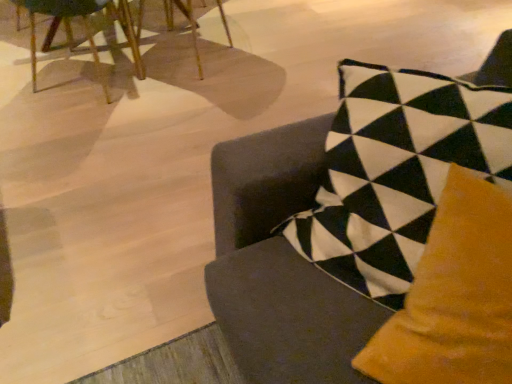
Describe the element at coordinates (280, 265) in the screenshot. The width and height of the screenshot is (512, 384). I see `velvet cushion at center, the third chair positioned from the left` at that location.

Find the location of a particular element. The height and width of the screenshot is (384, 512). velvet cushion at center, the 3th chair when ordered from back to front is located at coordinates (280, 265).

The image size is (512, 384). What do you see at coordinates (85, 30) in the screenshot?
I see `wooden chair at upper left, acting as the second chair starting from the back` at bounding box center [85, 30].

Find the location of a particular element. The image size is (512, 384). wooden chair at upper left, positioned as the third chair in front-to-back order is located at coordinates (188, 25).

You are a GUI agent. You are given a task and a screenshot of the screen. Output one action in this format:
    pyautogui.click(x=<x>, y=<y>)
    Task: Click on the velvet cushion at center, marked as the first chair in a right-to-left arrangement
    Image resolution: width=512 pixels, height=384 pixels.
    Given the screenshot: What is the action you would take?
    pyautogui.click(x=280, y=265)

From a real-world perspective, is velvet cushion at center, the 3th chair when ordered from back to front, physically above wooden chair at upper left, which is counted as the first chair, starting from the left?

Yes, from a real-world perspective, velvet cushion at center, the 3th chair when ordered from back to front, is over wooden chair at upper left, which is counted as the first chair, starting from the left

Is wooden chair at upper left, acting as the second chair starting from the back, inside velvet cushion at center, the third chair positioned from the left?

No.

What's the angular difference between velvet cushion at center, which ranks as the 1th chair in front-to-back order, and wooden chair at upper left, placed as the second chair when sorted from front to back,'s facing directions?

velvet cushion at center, which ranks as the 1th chair in front-to-back order, and wooden chair at upper left, placed as the second chair when sorted from front to back, are facing 136 degrees away from each other.

Which is behind, point (170, 9) or point (99, 75)?

The point (170, 9) is farther.

Is wooden chair at upper left, the 2th chair viewed from the right, looking in the opposite direction of wooden chair at upper left, acting as the second chair starting from the back?

That's not correct — wooden chair at upper left, the 2th chair viewed from the right, is not looking away from wooden chair at upper left, acting as the second chair starting from the back.

From a real-world perspective, between wooden chair at upper left, which is the 1th chair from back to front, and wooden chair at upper left, placed as the second chair when sorted from front to back, who is vertically lower?

wooden chair at upper left, which is the 1th chair from back to front.

From the image's perspective, is wooden chair at upper left, positioned as the third chair in front-to-back order, located above or below wooden chair at upper left, placed as the second chair when sorted from front to back?

wooden chair at upper left, positioned as the third chair in front-to-back order, is situated higher than wooden chair at upper left, placed as the second chair when sorted from front to back, in the image.

Would you say wooden chair at upper left, acting as the second chair starting from the back, is inside or outside wooden chair at upper left, the 2th chair in the left-to-right sequence?

wooden chair at upper left, acting as the second chair starting from the back, is located beyond the bounds of wooden chair at upper left, the 2th chair in the left-to-right sequence.

Are wooden chair at upper left, which is the third chair in right-to-left order, and wooden chair at upper left, the 2th chair in the left-to-right sequence, making contact?

No, wooden chair at upper left, which is the third chair in right-to-left order, is not next to wooden chair at upper left, the 2th chair in the left-to-right sequence.

From the image's perspective, between wooden chair at upper left, which is the third chair in right-to-left order, and wooden chair at upper left, the 2th chair viewed from the right, which one is located above?

wooden chair at upper left, the 2th chair viewed from the right, is shown above in the image.

Between wooden chair at upper left, placed as the second chair when sorted from front to back, and wooden chair at upper left, the 2th chair viewed from the right, which one appears on the left side from the viewer's perspective?

From the viewer's perspective, wooden chair at upper left, placed as the second chair when sorted from front to back, appears more on the left side.

Which is correct: wooden chair at upper left, positioned as the third chair in front-to-back order, is inside velvet cushion at center, the 3th chair when ordered from back to front, or outside of it?

wooden chair at upper left, positioned as the third chair in front-to-back order, exists outside the volume of velvet cushion at center, the 3th chair when ordered from back to front.

Considering the relative positions of wooden chair at upper left, the 2th chair viewed from the right, and velvet cushion at center, marked as the first chair in a right-to-left arrangement, in the image provided, is wooden chair at upper left, the 2th chair viewed from the right, behind velvet cushion at center, marked as the first chair in a right-to-left arrangement,?

That is True.

Does wooden chair at upper left, which is the 1th chair from back to front, turn towards velvet cushion at center, marked as the first chair in a right-to-left arrangement?

No, wooden chair at upper left, which is the 1th chair from back to front, does not turn towards velvet cushion at center, marked as the first chair in a right-to-left arrangement.

Does point (242, 333) come behind point (201, 66)?

That is False.

Can you confirm if velvet cushion at center, which ranks as the 1th chair in front-to-back order, is wider than wooden chair at upper left, positioned as the third chair in front-to-back order?

Incorrect, the width of velvet cushion at center, which ranks as the 1th chair in front-to-back order, does not surpass that of wooden chair at upper left, positioned as the third chair in front-to-back order.

Is velvet cushion at center, the 3th chair when ordered from back to front, closer to the viewer compared to wooden chair at upper left, positioned as the third chair in front-to-back order?

Yes, velvet cushion at center, the 3th chair when ordered from back to front, is closer to the viewer.

Could wooden chair at upper left, the 2th chair viewed from the right, be considered to be inside velvet cushion at center, which ranks as the 1th chair in front-to-back order?

No, wooden chair at upper left, the 2th chair viewed from the right, is not surrounded by velvet cushion at center, which ranks as the 1th chair in front-to-back order.

Considering the sizes of objects wooden chair at upper left, which is the third chair in right-to-left order, and velvet cushion at center, the third chair positioned from the left, in the image provided, who is wider, wooden chair at upper left, which is the third chair in right-to-left order, or velvet cushion at center, the third chair positioned from the left,?

With larger width is wooden chair at upper left, which is the third chair in right-to-left order.

From a real-world perspective, who is located lower, wooden chair at upper left, acting as the second chair starting from the back, or velvet cushion at center, which ranks as the 1th chair in front-to-back order?

wooden chair at upper left, acting as the second chair starting from the back, is physically lower.

Is wooden chair at upper left, placed as the second chair when sorted from front to back, positioned in front of velvet cushion at center, the 3th chair when ordered from back to front?

No, it is behind velvet cushion at center, the 3th chair when ordered from back to front.

Which of these two, wooden chair at upper left, which is the third chair in right-to-left order, or velvet cushion at center, marked as the first chair in a right-to-left arrangement, is smaller?

Smaller between the two is wooden chair at upper left, which is the third chair in right-to-left order.

From the image's perspective, count 1st chairs upward from the velvet cushion at center, the third chair positioned from the left, and point to it. Please provide its 2D coordinates.

[(85, 30)]

The width and height of the screenshot is (512, 384). Identify the location of chair located behind the wooden chair at upper left, acting as the second chair starting from the back. (188, 25).

Looking at the image, which one is located further to velvet cushion at center, marked as the first chair in a right-to-left arrangement, wooden chair at upper left, which is the third chair in right-to-left order, or wooden chair at upper left, the 2th chair viewed from the right?

wooden chair at upper left, the 2th chair viewed from the right, is positioned further to the anchor velvet cushion at center, marked as the first chair in a right-to-left arrangement.

Looking at the image, which one is located further to wooden chair at upper left, which is counted as the first chair, starting from the left, velvet cushion at center, the third chair positioned from the left, or wooden chair at upper left, positioned as the third chair in front-to-back order?

The object further to wooden chair at upper left, which is counted as the first chair, starting from the left, is velvet cushion at center, the third chair positioned from the left.

Which object lies further to the anchor point wooden chair at upper left, the 2th chair viewed from the right, velvet cushion at center, the third chair positioned from the left, or wooden chair at upper left, acting as the second chair starting from the back?

The object further to wooden chair at upper left, the 2th chair viewed from the right, is velvet cushion at center, the third chair positioned from the left.

Looking at the image, which one is located closer to velvet cushion at center, the third chair positioned from the left, wooden chair at upper left, which is the 1th chair from back to front, or wooden chair at upper left, which is counted as the first chair, starting from the left?

wooden chair at upper left, which is counted as the first chair, starting from the left, lies closer to velvet cushion at center, the third chair positioned from the left, than the other object.

Considering their positions, is wooden chair at upper left, which is the 1th chair from back to front, positioned further to wooden chair at upper left, which is the third chair in right-to-left order, than velvet cushion at center, the 3th chair when ordered from back to front?

velvet cushion at center, the 3th chair when ordered from back to front.

Considering their positions, is wooden chair at upper left, acting as the second chair starting from the back, positioned closer to wooden chair at upper left, positioned as the third chair in front-to-back order, than velvet cushion at center, the third chair positioned from the left?

wooden chair at upper left, acting as the second chair starting from the back.

This screenshot has width=512, height=384. Find the location of `chair between velvet cushion at center, marked as the first chair in a right-to-left arrangement, and wooden chair at upper left, the 2th chair in the left-to-right sequence, along the z-axis`. chair between velvet cushion at center, marked as the first chair in a right-to-left arrangement, and wooden chair at upper left, the 2th chair in the left-to-right sequence, along the z-axis is located at coordinates (85, 30).